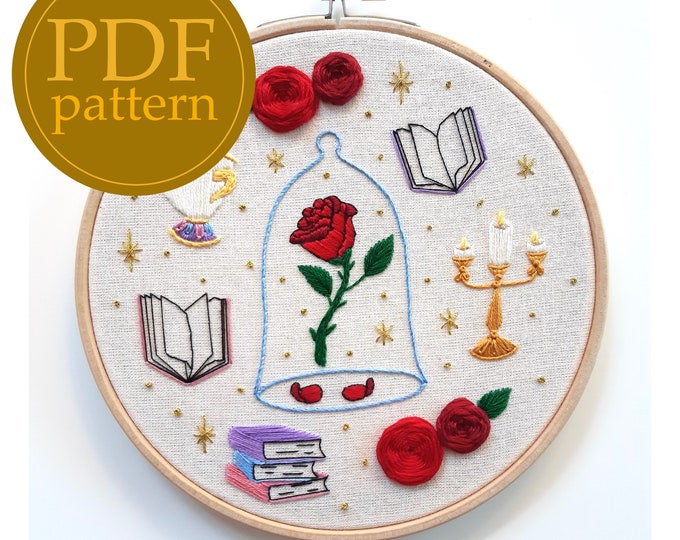
I want to click on candles, so [498, 244], [537, 241], [464, 251].